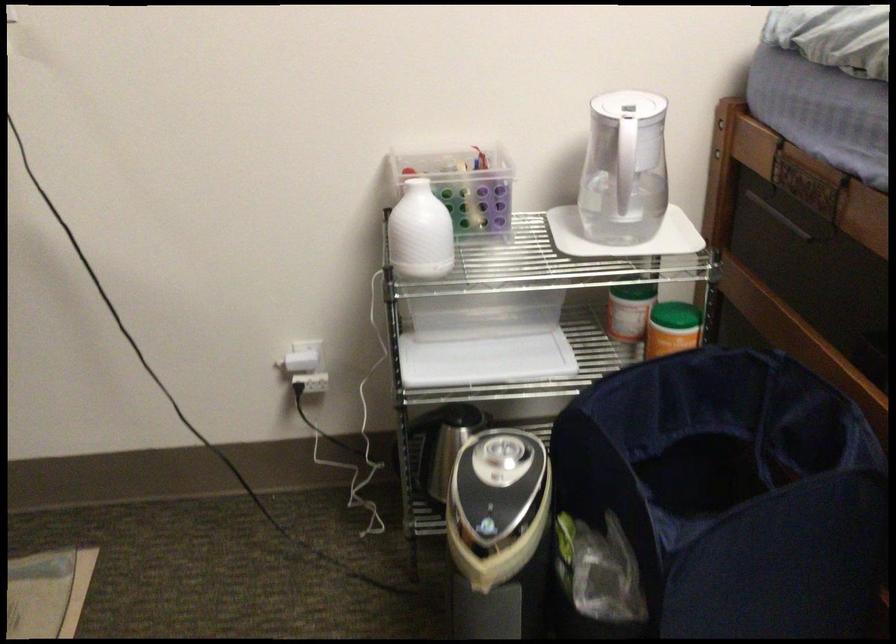
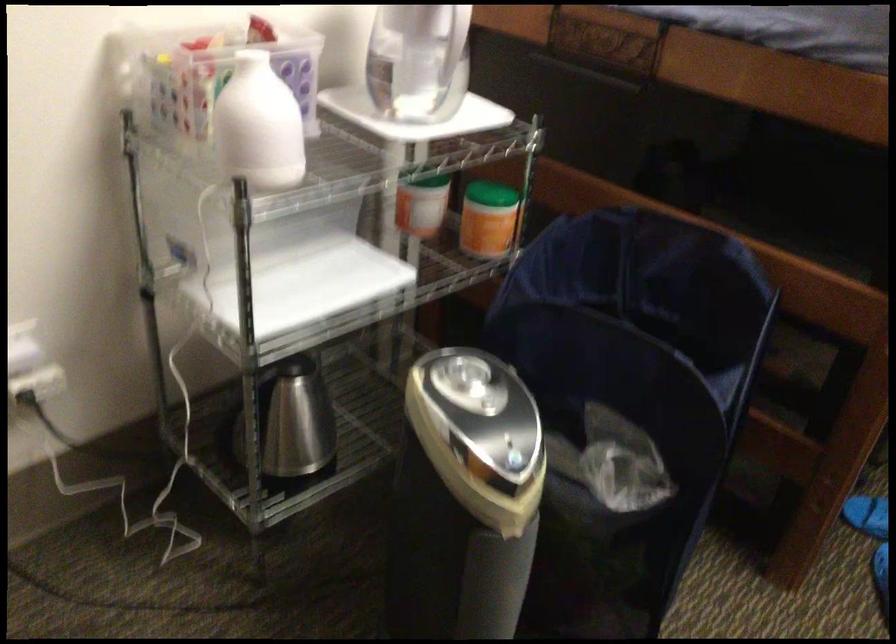
Question: The first image is from the beginning of the video and the second image is from the end. How did the camera likely rotate when shooting the video?

Choices:
 (A) Left
 (B) Right
 (C) Up
 (D) Down

Answer: (B)